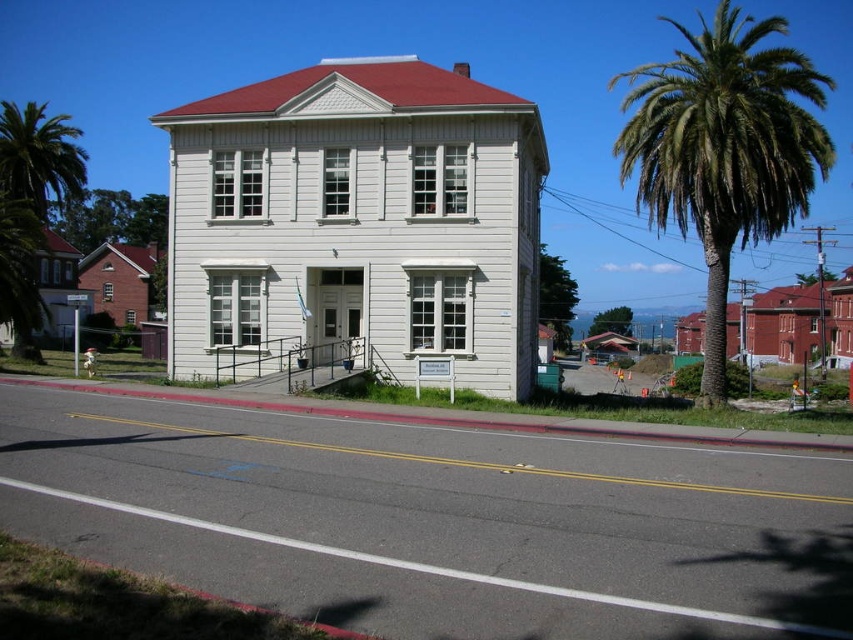
Question: Can you confirm if green leafy palm tree at right is positioned to the left of green leafy palm tree at left?

Choices:
 (A) no
 (B) yes

Answer: (A)

Question: Among these points, which one is farthest from the camera?

Choices:
 (A) (39, 172)
 (B) (799, 83)

Answer: (A)

Question: Can you confirm if green leafy palm tree at right is smaller than green leafy palm tree at left?

Choices:
 (A) yes
 (B) no

Answer: (B)

Question: Does green leafy palm tree at right have a larger size compared to green leafy palm tree at left?

Choices:
 (A) no
 (B) yes

Answer: (B)

Question: Which object is farther from the camera taking this photo?

Choices:
 (A) green leafy palm tree at left
 (B) green leafy palm tree at right

Answer: (A)